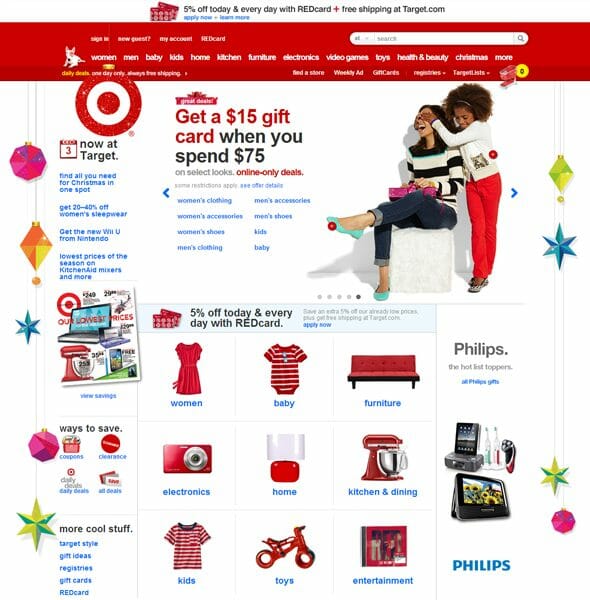
Locate an element on the screen. The image size is (590, 600). shortest ornament is located at coordinates pos(22,165).